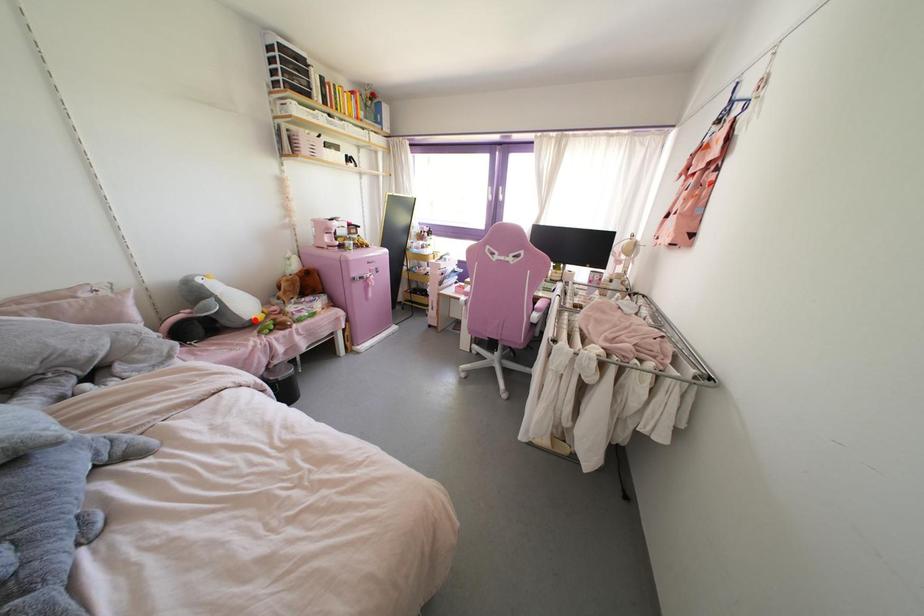
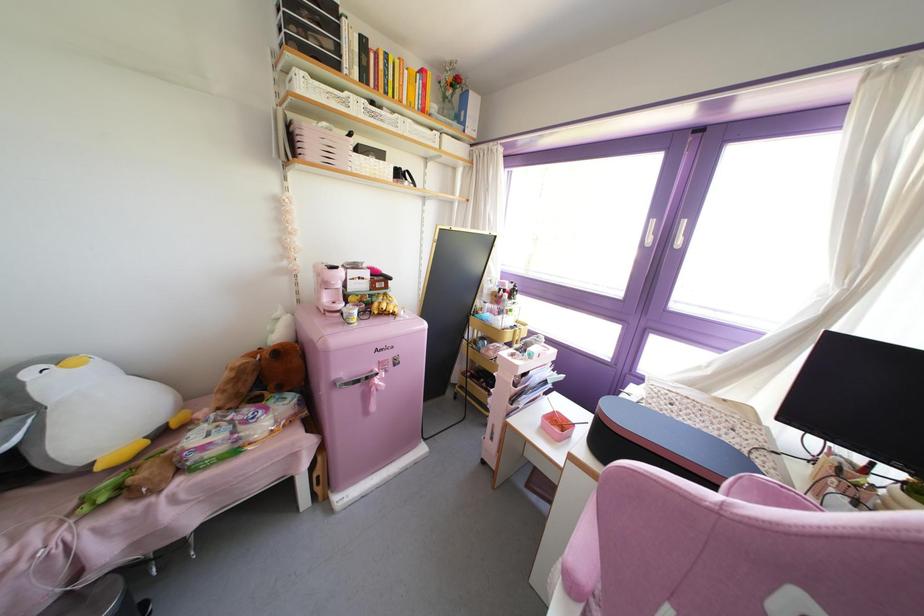
Question: I am providing you with two images of the same scene from different viewpoints. In image1, a red point is highlighted. Considering the same 3D point in image2, which of the following is correct?

Choices:
 (A) It is closer
 (B) It is farther

Answer: (A)